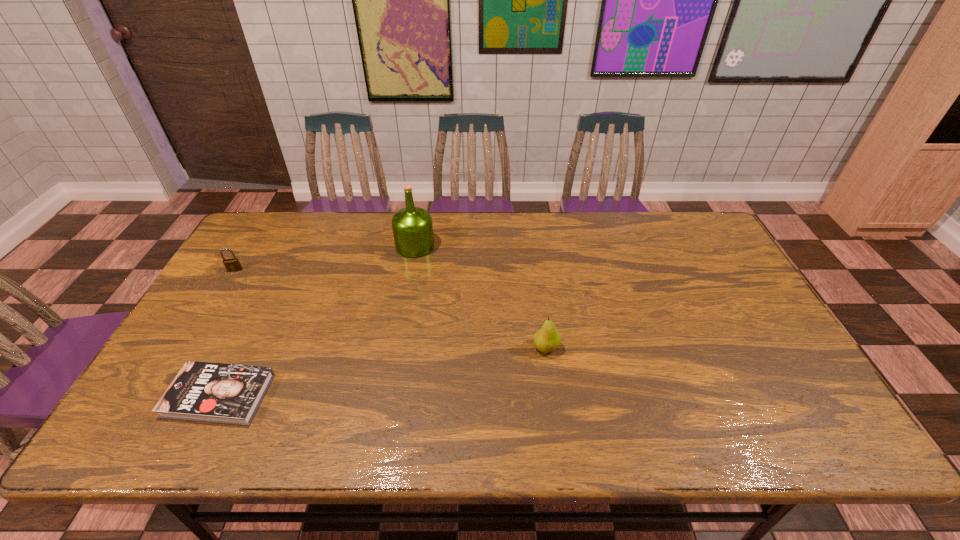
At what (x,y) coordinates should I click in order to perform the action: click on the farthest object. Please return your answer as a coordinate pair (x, y). Looking at the image, I should click on (412, 226).

You are a GUI agent. You are given a task and a screenshot of the screen. Output one action in this format:
    pyautogui.click(x=<x>, y=<y>)
    Task: Click on the tallest object
    The height and width of the screenshot is (540, 960).
    Given the screenshot: What is the action you would take?
    pyautogui.click(x=412, y=226)

Where is `the third shortest object`? This screenshot has height=540, width=960. the third shortest object is located at coordinates (547, 339).

Where is `the rightmost object`? the rightmost object is located at coordinates (547, 339).

At what (x,y) coordinates should I click in order to perform the action: click on the second shortest object. Please return your answer as a coordinate pair (x, y). Looking at the image, I should click on (232, 265).

The width and height of the screenshot is (960, 540). In order to click on padlock in this screenshot , I will do `click(232, 265)`.

I want to click on book, so [209, 392].

Where is `the second object from left to right`? the second object from left to right is located at coordinates click(209, 392).

Identify the location of vacant space positioned 0.110m on the front of the farthest object. 409,282.

In order to click on vacant region located 0.120m on the right of the third shortest object in this screenshot , I will do `click(605, 348)`.